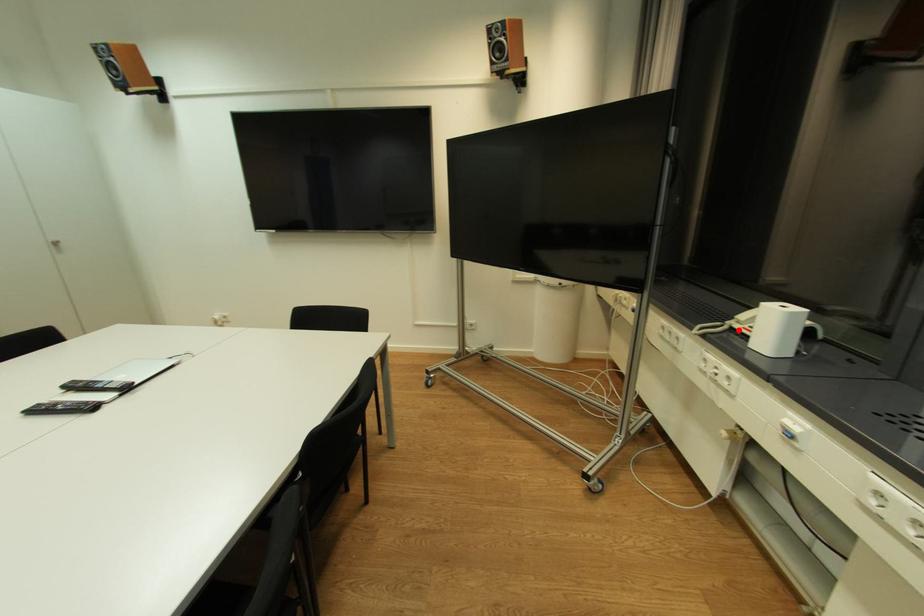
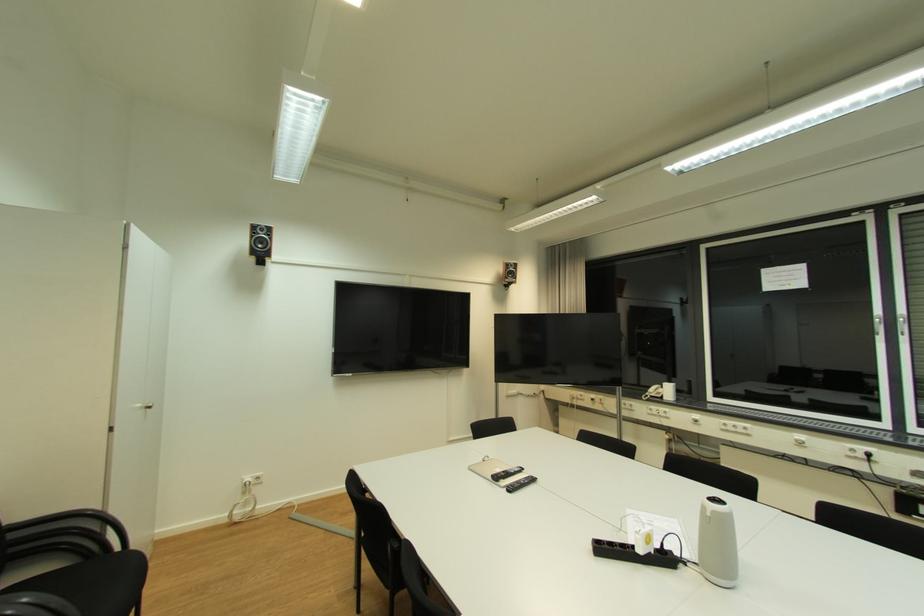
The point at the highlighted location is marked in the first image. Where is the corresponding point in the second image?

(657, 397)